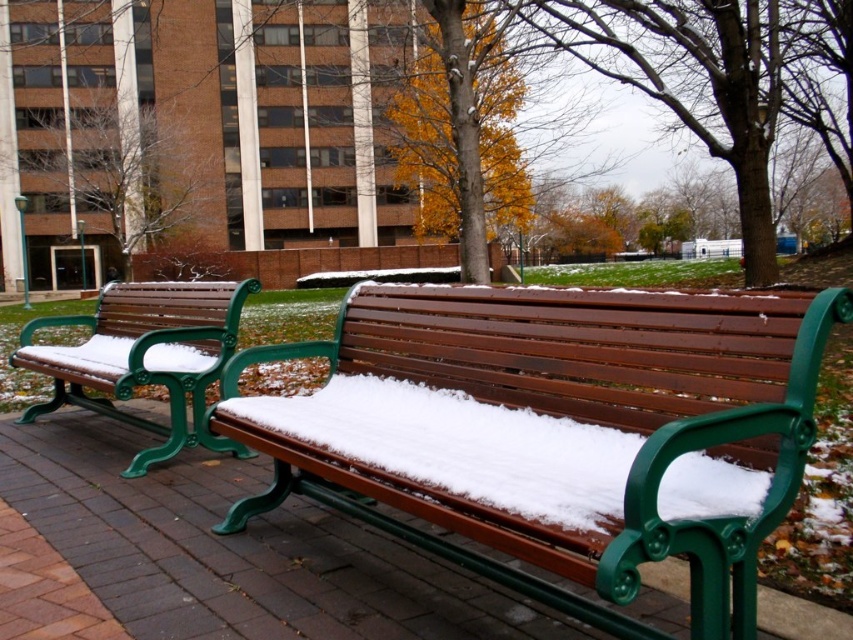
Does matte wood bench at center have a greater height compared to white fluffy snow at center?

Correct, matte wood bench at center is much taller as white fluffy snow at center.

Does point (556, 307) come closer to viewer compared to point (543, 520)?

No, it is not.

At what (x,y) coordinates should I click in order to perform the action: click on matte wood bench at center. Please return your answer as a coordinate pair (x, y). This screenshot has width=853, height=640. Looking at the image, I should click on (556, 429).

Can you confirm if white fluffy snow at center is wider than wooden bench at left?

No, white fluffy snow at center is not wider than wooden bench at left.

Is white fluffy snow at center below wooden bench at left?

Correct, white fluffy snow at center is located below wooden bench at left.

Locate an element on the screen. The width and height of the screenshot is (853, 640). white fluffy snow at center is located at coordinates (462, 445).

Where is `white fluffy snow at center`? white fluffy snow at center is located at coordinates (462, 445).

In the scene shown: Who is lower down, matte wood bench at center or wooden bench at left?

matte wood bench at center is below.

Locate an element on the screen. This screenshot has width=853, height=640. matte wood bench at center is located at coordinates (556, 429).